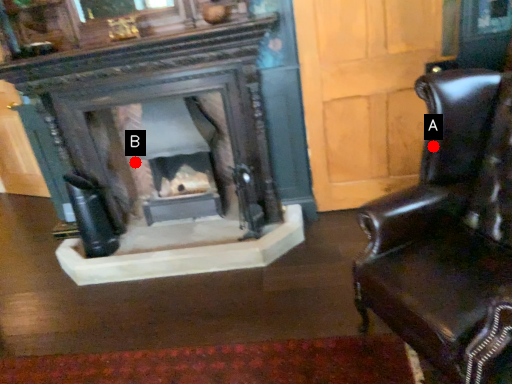
Question: Two points are circled on the image, labeled by A and B beside each circle. Which point is closer to the camera?

Choices:
 (A) A is closer
 (B) B is closer

Answer: (A)